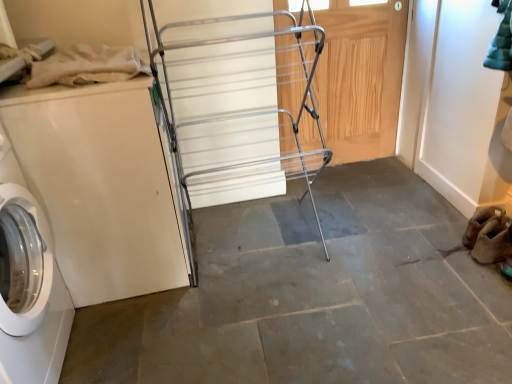
At what (x,y) coordinates should I click in order to perform the action: click on space that is in front of white glossy washing machine at left. Please return your answer as a coordinate pair (x, y). The height and width of the screenshot is (384, 512). Looking at the image, I should click on (160, 336).